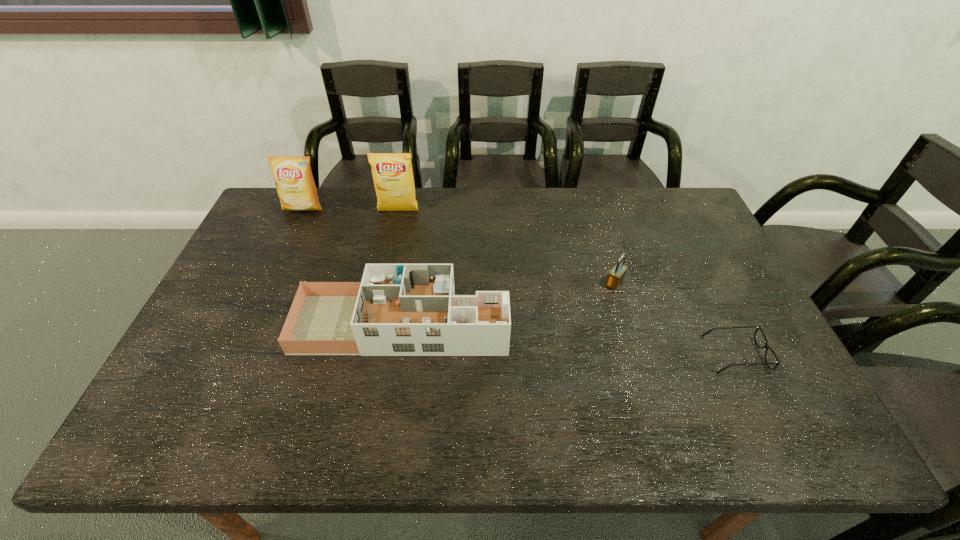
At what (x,y) coordinates should I click in order to perform the action: click on vacant area located 0.360m at the front door of the dollhouse. Please return your answer as a coordinate pair (x, y). The width and height of the screenshot is (960, 540). Looking at the image, I should click on (641, 324).

You are a GUI agent. You are given a task and a screenshot of the screen. Output one action in this format:
    pyautogui.click(x=<x>, y=<y>)
    Task: Click on the vacant area located on the left of the padlock
    The height and width of the screenshot is (540, 960).
    Given the screenshot: What is the action you would take?
    pyautogui.click(x=571, y=283)

You are a GUI agent. You are given a task and a screenshot of the screen. Output one action in this format:
    pyautogui.click(x=<x>, y=<y>)
    Task: Click on the free spot located 0.100m with the lenses facing outward on the spectacles
    Image resolution: width=960 pixels, height=540 pixels.
    Given the screenshot: What is the action you would take?
    pyautogui.click(x=668, y=354)

This screenshot has width=960, height=540. In order to click on vacant space located with the lenses facing outward on the spectacles in this screenshot , I will do [x=565, y=354].

The height and width of the screenshot is (540, 960). In order to click on vacant space situated 0.230m with the lenses facing outward on the spectacles in this screenshot , I will do `click(617, 354)`.

Find the location of a particular element. The width and height of the screenshot is (960, 540). object at the left edge is located at coordinates (295, 185).

Find the location of a particular element. This screenshot has height=540, width=960. object that is positioned at the right edge is located at coordinates (766, 346).

Where is `object that is at the far left corner`? The width and height of the screenshot is (960, 540). object that is at the far left corner is located at coordinates (295, 185).

This screenshot has height=540, width=960. In order to click on free space at the far edge in this screenshot , I will do `click(581, 225)`.

This screenshot has width=960, height=540. Identify the location of vacant space at the near edge of the desktop. (747, 447).